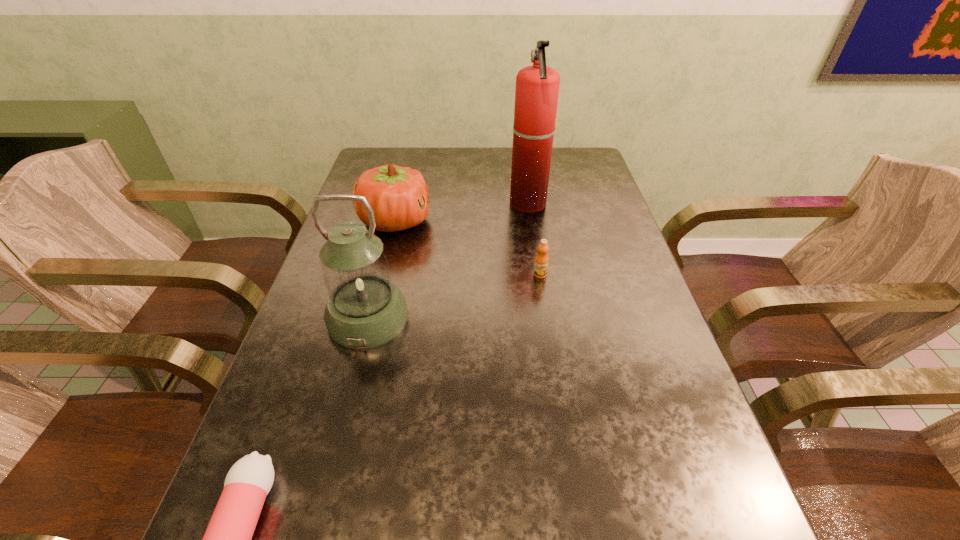
You are a GUI agent. You are given a task and a screenshot of the screen. Output one action in this format:
    pyautogui.click(x=<x>, y=<y>)
    Task: Click on the empty location between the orange juice and the second nearest object
    The image size is (960, 540).
    Given the screenshot: What is the action you would take?
    pyautogui.click(x=454, y=296)

At what (x,y) coordinates should I click in order to perform the action: click on empty space that is in between the orange juice and the fire extinguisher. Please return your answer as a coordinate pair (x, y). The image size is (960, 540). Looking at the image, I should click on (535, 239).

The image size is (960, 540). I want to click on vacant space that is in between the third farthest object and the fourth shortest object, so click(x=454, y=296).

This screenshot has width=960, height=540. I want to click on vacant space that's between the orange juice and the pumpkin, so click(468, 248).

Locate which object is the closest to the second tallest object. Please provide its 2D coordinates. Your answer should be formatted as a tuple, i.e. [(x, y)], where the tuple contains the x and y coordinates of a point satisfying the conditions above.

[(399, 197)]

Locate an element on the screen. Image resolution: width=960 pixels, height=540 pixels. object that is the second closest to the second tallest object is located at coordinates (227, 539).